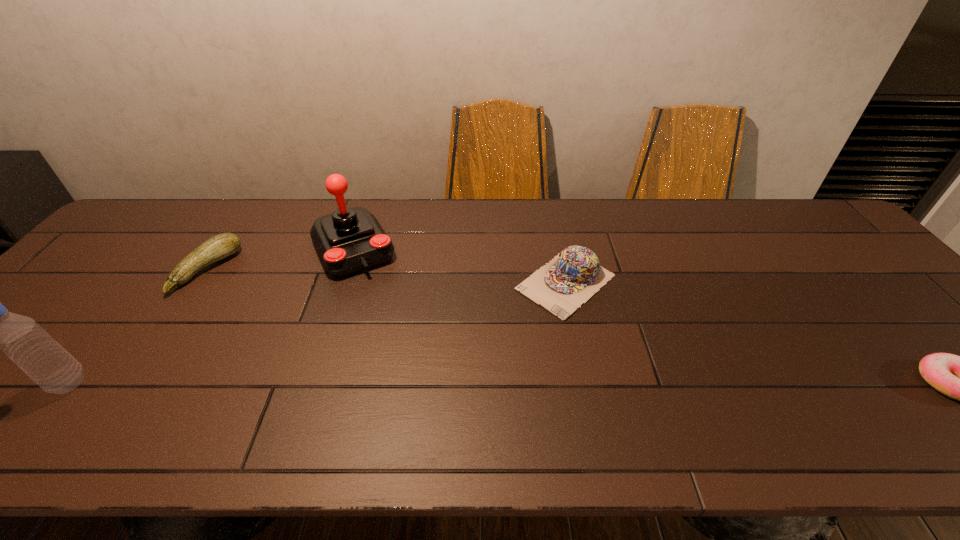
The image size is (960, 540). Identify the location of the leftmost object. (22, 339).

You are a GUI agent. You are given a task and a screenshot of the screen. Output one action in this format:
    pyautogui.click(x=<x>, y=<y>)
    Task: Click on the fourth object from left to right
    Image resolution: width=960 pixels, height=540 pixels.
    Given the screenshot: What is the action you would take?
    pyautogui.click(x=571, y=278)

This screenshot has height=540, width=960. Find the location of `joystick`. joystick is located at coordinates point(350,240).

At what (x,y) coordinates should I click in order to perform the action: click on zucchini. Please return your answer as a coordinate pair (x, y). The image size is (960, 540). Looking at the image, I should click on (221, 246).

Locate an element on the screen. free point located on the right of the leftmost object is located at coordinates (241, 383).

Locate an element on the screen. vacant space situated on the front, side, and top of the second object from right to left is located at coordinates coord(477,355).

Where is `free space located 0.290m on the front, side, and top of the second object from right to left`? The width and height of the screenshot is (960, 540). free space located 0.290m on the front, side, and top of the second object from right to left is located at coordinates (449, 379).

The height and width of the screenshot is (540, 960). I want to click on vacant space located 0.160m on the front, side, and top of the second object from right to left, so click(x=490, y=346).

The image size is (960, 540). I want to click on free space located on the base of the joystick, so click(x=395, y=331).

Locate an element on the screen. This screenshot has width=960, height=540. vacant space located 0.300m on the base of the joystick is located at coordinates 407,355.